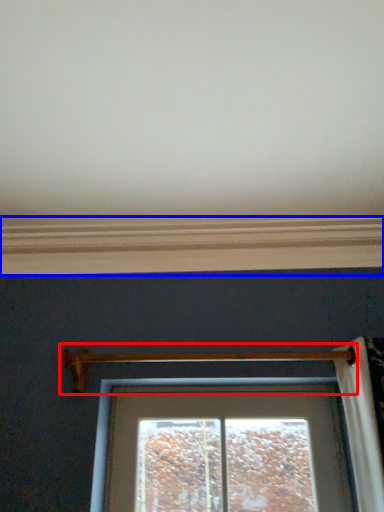
Question: Which object is closer to the camera taking this photo, door handle (highlighted by a red box) or window sill (highlighted by a blue box)?

Choices:
 (A) door handle
 (B) window sill

Answer: (A)